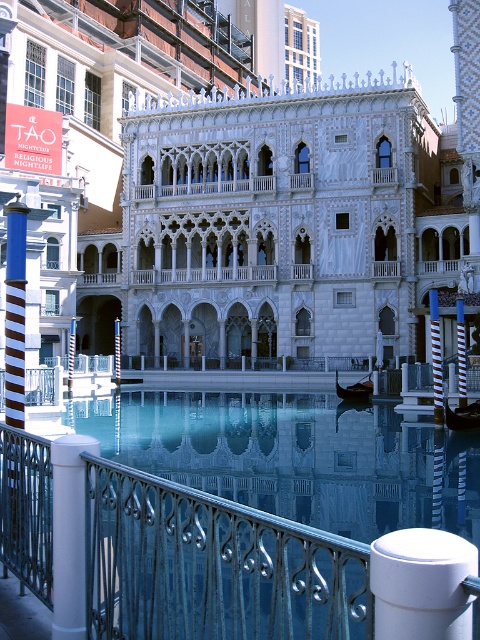
Question: Which point appears farthest from the camera in this image?

Choices:
 (A) (141, 589)
 (B) (17, 116)
 (C) (74, 588)

Answer: (B)

Question: Does white marble palace at center have a greater width compared to white matte/porcelain pillar at lower left?

Choices:
 (A) no
 (B) yes

Answer: (B)

Question: Can you confirm if white marble palace at center is wider than blue-green wrought iron railing at lower center?

Choices:
 (A) yes
 (B) no

Answer: (A)

Question: Which point is closer to the camera?

Choices:
 (A) (464, 236)
 (B) (60, 544)

Answer: (B)

Question: Which point is closer to the camera?

Choices:
 (A) white marble palace at center
 (B) white matte/porcelain pillar at lower left
 (C) blue-green wrought iron railing at lower center

Answer: (C)

Question: Is white marble palace at center thinner than white matte/porcelain pillar at lower left?

Choices:
 (A) no
 (B) yes

Answer: (A)